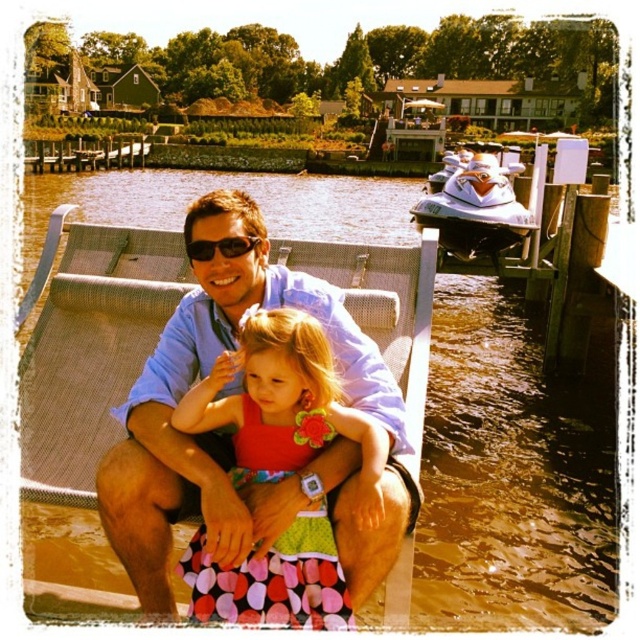
You are a photographer trying to capture the perfect shot of the scene. You notice a point at coordinates (228, 435). What object is located at this point?

The object at point (228, 435) is the matte blue shirt at center.

You are a photographer trying to capture a candid shot of the two people on the dock. You want to ensure that both the matte blue shirt at center and the polka dot fabric dress at center are clearly visible in the frame. Given their positions, which one should you focus on first to ensure the other remains in focus?

The matte blue shirt at center is taller than the polka dot fabric dress at center, so focusing on the taller matte blue shirt at center first will help ensure the shorter polka dot fabric dress at center stays in focus as well.